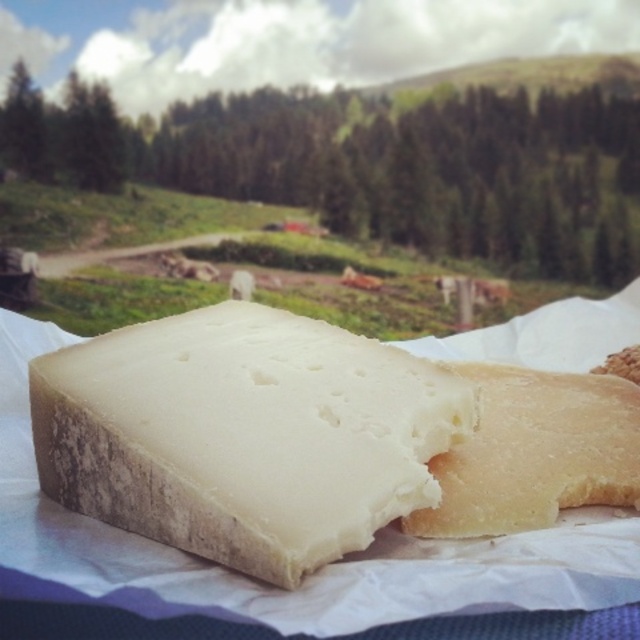
Who is higher up, white crumbly cheese at center or white crumbly bread at center?

white crumbly cheese at center is above.

Looking at this image, measure the distance between white crumbly cheese at center and camera.

A distance of 27.79 centimeters exists between white crumbly cheese at center and camera.

Find the location of a particular element. The image size is (640, 640). white crumbly cheese at center is located at coordinates (244, 435).